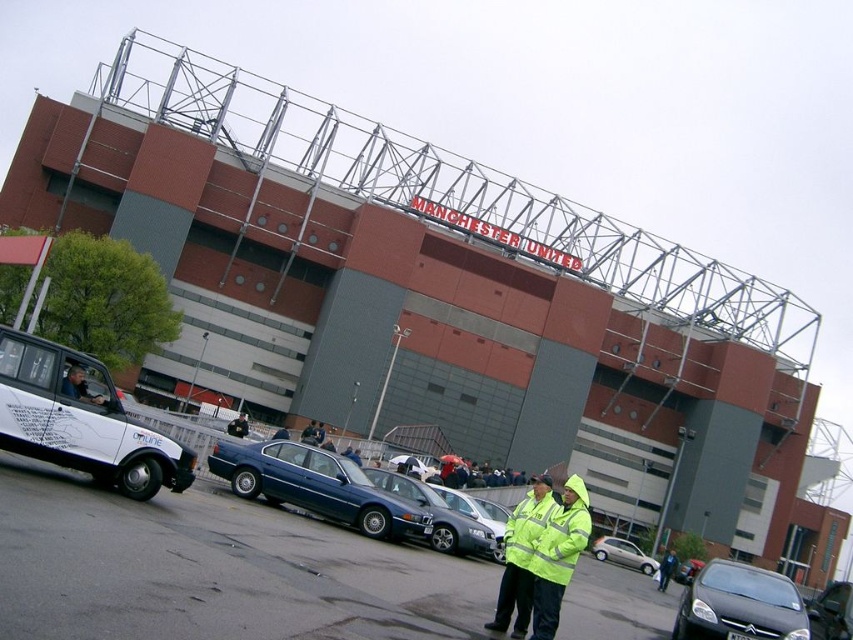
Can you confirm if shiny blue sedan at center is bigger than metallic silver sedan at center?

Yes.

Between shiny blue sedan at center and metallic silver sedan at center, which one appears on the right side from the viewer's perspective?

Positioned to the right is metallic silver sedan at center.

Does point (321, 481) come closer to viewer compared to point (438, 490)?

That is True.

Where is `shiny blue sedan at center`? This screenshot has height=640, width=853. shiny blue sedan at center is located at coordinates (316, 486).

Consider the image. Does shiny black car at lower right have a greater width compared to dark blue leather jacket at center?

Correct, the width of shiny black car at lower right exceeds that of dark blue leather jacket at center.

Describe the element at coordinates (740, 604) in the screenshot. I see `shiny black car at lower right` at that location.

Is point (761, 568) closer to viewer compared to point (236, 436)?

No, (761, 568) is further to viewer.

The image size is (853, 640). Find the location of `shiny black car at lower right`. shiny black car at lower right is located at coordinates (740, 604).

Can you confirm if white matte van at left is positioned to the right of dark blue leather jacket at center?

Correct, you'll find white matte van at left to the right of dark blue leather jacket at center.

Does white matte van at left have a greater height compared to dark blue leather jacket at center?

Yes, white matte van at left is taller than dark blue leather jacket at center.

Is point (187, 460) farther from camera compared to point (245, 419)?

No, (187, 460) is in front of (245, 419).

Identify the location of white matte van at left. (80, 419).